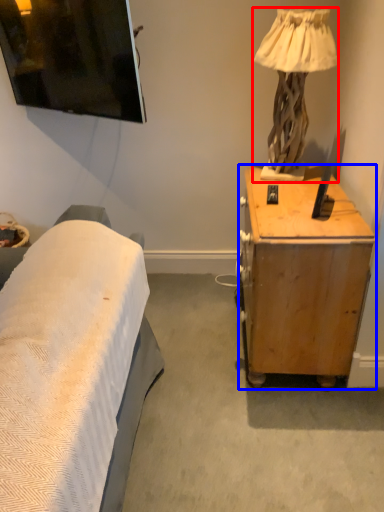
Question: Which point is closer to the camera, lamp (highlighted by a red box) or desk (highlighted by a blue box)?

Choices:
 (A) lamp
 (B) desk

Answer: (B)